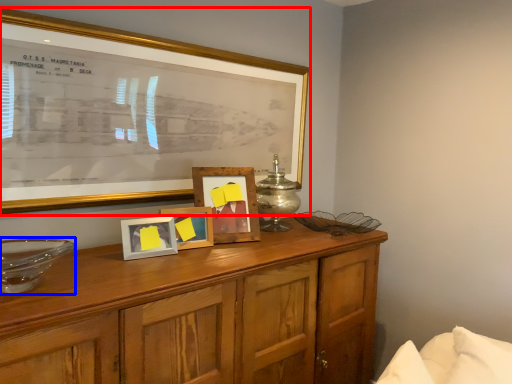
Question: Which object is closer to the camera taking this photo, picture frame (highlighted by a red box) or glass bowl (highlighted by a blue box)?

Choices:
 (A) picture frame
 (B) glass bowl

Answer: (B)